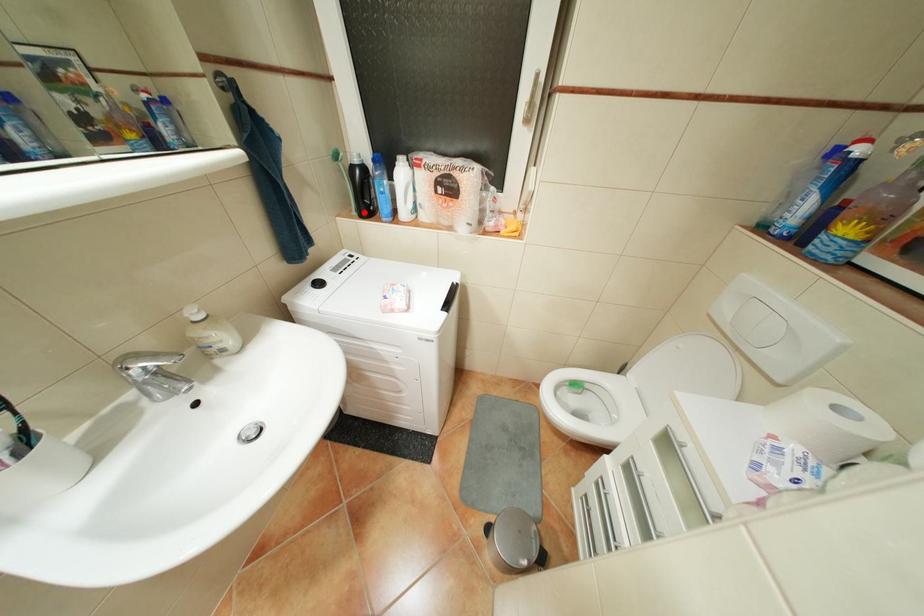
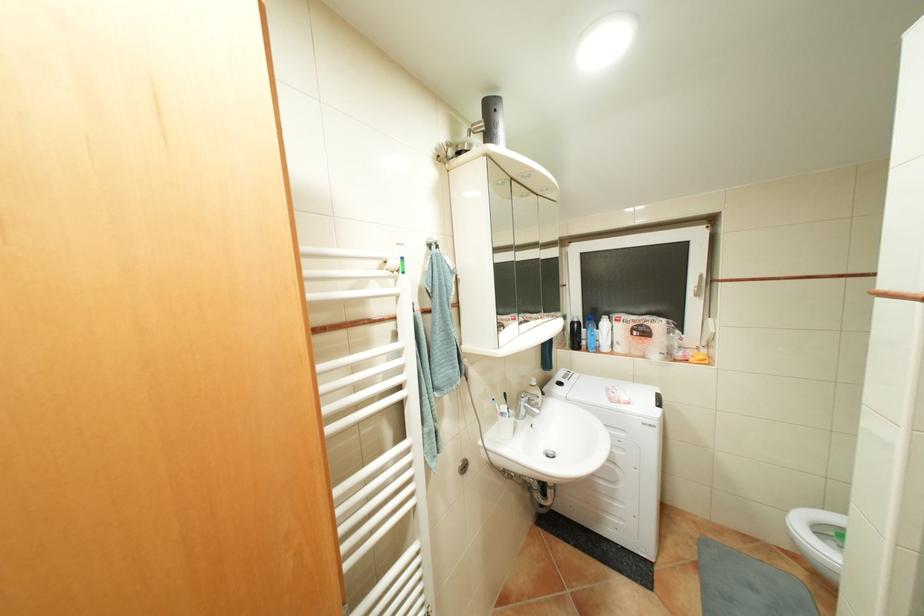
Locate, in the second image, the point that corresponds to the highlighted location in the first image.

(578, 346)